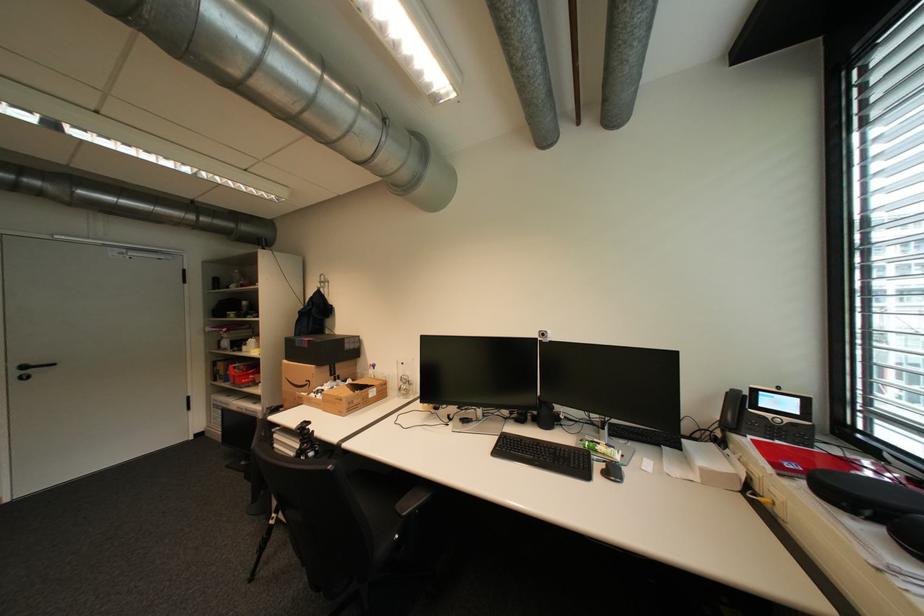
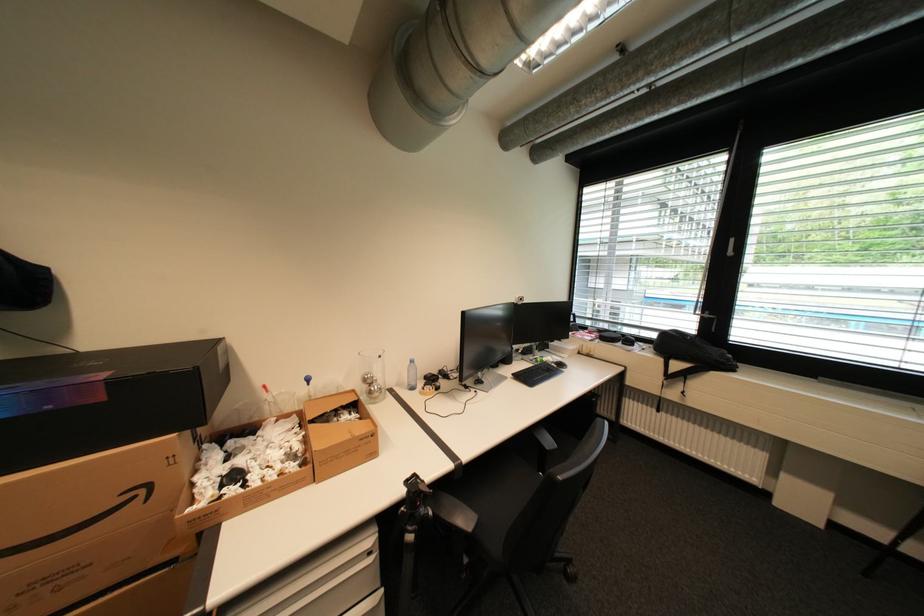
The point at (x=317, y=383) is marked in the first image. Where is the corresponding point in the second image?

(151, 491)